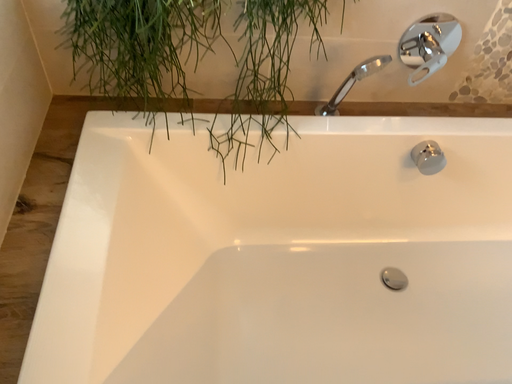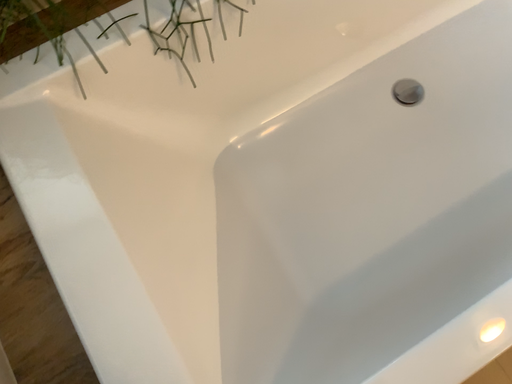
Question: How did the camera likely rotate when shooting the video?

Choices:
 (A) rotated right
 (B) rotated left

Answer: (A)